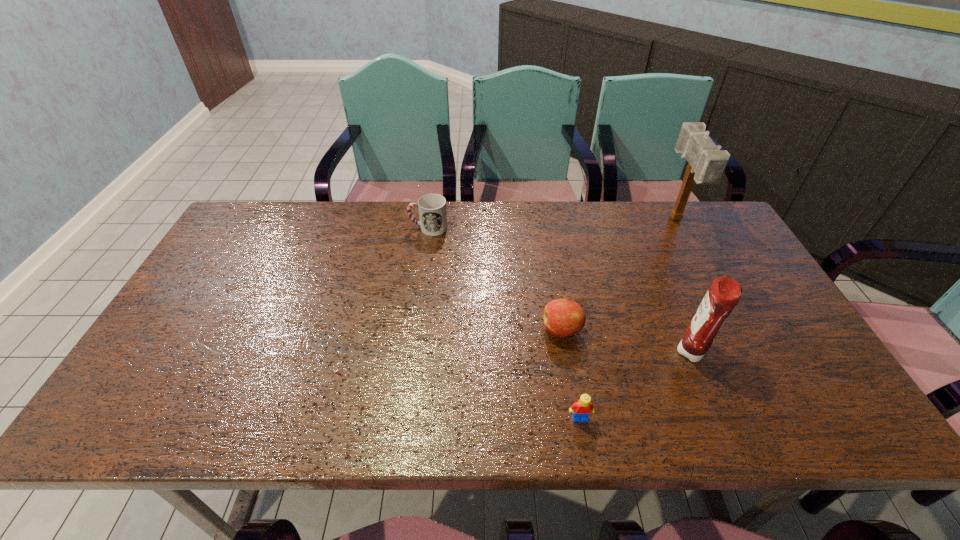
At what (x,y) coordinates should I click in order to perform the action: click on vacant space that's between the apple and the fourth shortest object. Please return your answer as a coordinate pair (x, y). The height and width of the screenshot is (540, 960). Looking at the image, I should click on (628, 342).

You are a GUI agent. You are given a task and a screenshot of the screen. Output one action in this format:
    pyautogui.click(x=<x>, y=<y>)
    Task: Click on the free area in between the rightmost object and the nearest object
    
    Given the screenshot: What is the action you would take?
    pyautogui.click(x=628, y=319)

Locate which object is the fourth closest to the cup. Please provide its 2D coordinates. Your answer should be formatted as a tuple, i.e. [(x, y)], where the tuple contains the x and y coordinates of a point satisfying the conditions above.

[(707, 162)]

Identify which object is the second nearest to the rightmost object. Please provide its 2D coordinates. Your answer should be formatted as a tuple, i.e. [(x, y)], where the tuple contains the x and y coordinates of a point satisfying the conditions above.

[(562, 317)]